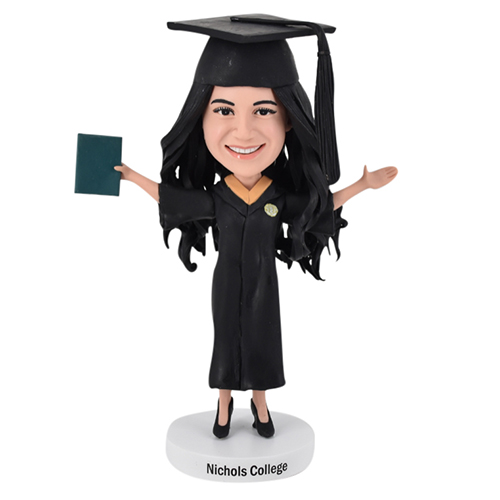
This screenshot has width=500, height=500. I want to click on booklet, so click(91, 158).